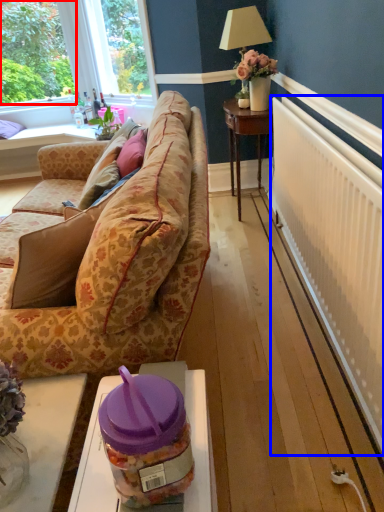
Question: Which point is closer to the camera, plant (highlighted by a red box) or radiator (highlighted by a blue box)?

Choices:
 (A) plant
 (B) radiator

Answer: (B)